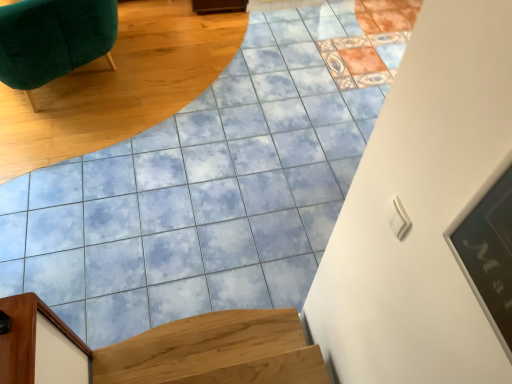
Question: Would you say velvet green chair at upper left, which ranks as the 2th furniture in bottom-to-top order, contains wooden door frame at lower left, which is the first furniture in right-to-left order?

Choices:
 (A) no
 (B) yes

Answer: (A)

Question: Is velvet green chair at upper left, which is counted as the 1th furniture, starting from the back, at the right side of wooden door frame at lower left, which appears as the 1th furniture when viewed from the front?

Choices:
 (A) yes
 (B) no

Answer: (B)

Question: Is velvet green chair at upper left, positioned as the second furniture in front-to-back order, further to camera compared to wooden door frame at lower left, which appears as the 1th furniture when viewed from the front?

Choices:
 (A) no
 (B) yes

Answer: (B)

Question: Does velvet green chair at upper left, positioned as the second furniture in front-to-back order, lie in front of wooden door frame at lower left, positioned as the second furniture in top-to-bottom order?

Choices:
 (A) no
 (B) yes

Answer: (A)

Question: From the image's perspective, would you say velvet green chair at upper left, positioned as the second furniture in front-to-back order, is shown under wooden door frame at lower left, which appears as the 1th furniture when viewed from the front?

Choices:
 (A) yes
 (B) no

Answer: (B)

Question: From the image's perspective, is light brown wood stairs at lower left located above or below velvet green chair at upper left, which is the first furniture in left-to-right order?

Choices:
 (A) above
 (B) below

Answer: (B)

Question: Considering the positions of light brown wood stairs at lower left and velvet green chair at upper left, the first furniture when ordered from top to bottom, in the image, is light brown wood stairs at lower left wider or thinner than velvet green chair at upper left, the first furniture when ordered from top to bottom,?

Choices:
 (A) thin
 (B) wide

Answer: (A)

Question: Would you say light brown wood stairs at lower left is inside or outside velvet green chair at upper left, which ranks as the 2th furniture in bottom-to-top order?

Choices:
 (A) outside
 (B) inside

Answer: (A)

Question: In the image, is light brown wood stairs at lower left positioned in front of or behind velvet green chair at upper left, the 2th furniture positioned from the right?

Choices:
 (A) front
 (B) behind

Answer: (A)

Question: Is light brown wood stairs at lower left taller or shorter than wooden door frame at lower left, which is the first furniture in right-to-left order?

Choices:
 (A) short
 (B) tall

Answer: (A)

Question: Is light brown wood stairs at lower left in front of or behind wooden door frame at lower left, placed as the 2th furniture when sorted from left to right, in the image?

Choices:
 (A) front
 (B) behind

Answer: (B)

Question: From the image's perspective, relative to wooden door frame at lower left, placed as the 2th furniture when sorted from left to right, is light brown wood stairs at lower left above or below?

Choices:
 (A) below
 (B) above

Answer: (A)

Question: Based on their sizes in the image, would you say light brown wood stairs at lower left is bigger or smaller than wooden door frame at lower left, which is the first furniture in right-to-left order?

Choices:
 (A) small
 (B) big

Answer: (B)

Question: Is point (27, 52) positioned closer to the camera than point (169, 336)?

Choices:
 (A) closer
 (B) farther

Answer: (B)

Question: From their relative heights in the image, would you say velvet green chair at upper left, the 2th furniture positioned from the right, is taller or shorter than light brown wood stairs at lower left?

Choices:
 (A) short
 (B) tall

Answer: (B)